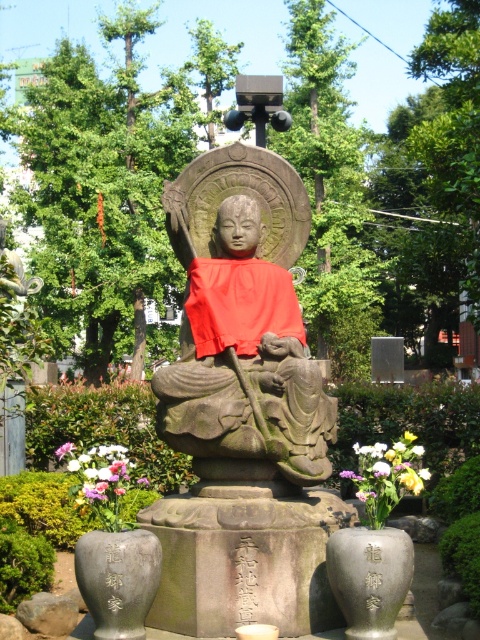
Question: Can you confirm if matte stone statue at center is thinner than pink fabric flowers at lower left?

Choices:
 (A) no
 (B) yes

Answer: (A)

Question: Which point is closer to the camera?

Choices:
 (A) pink fabric flowers at lower left
 (B) pink fabric flower at center
 (C) matte stone statue at center

Answer: (A)

Question: From the image, what is the correct spatial relationship of matte stone statue at center in relation to white matte flowers at lower center?

Choices:
 (A) left
 (B) right

Answer: (A)

Question: Is pink fabric flowers at lower left bigger than pink fabric flower at center?

Choices:
 (A) no
 (B) yes

Answer: (A)

Question: Which point is farther from the camera taking this photo?

Choices:
 (A) (99, 461)
 (B) (396, 477)
 (C) (208, 179)

Answer: (C)

Question: Which point appears closest to the camera in this image?

Choices:
 (A) (312, 364)
 (B) (108, 502)
 (C) (345, 470)
 (D) (56, 451)

Answer: (B)